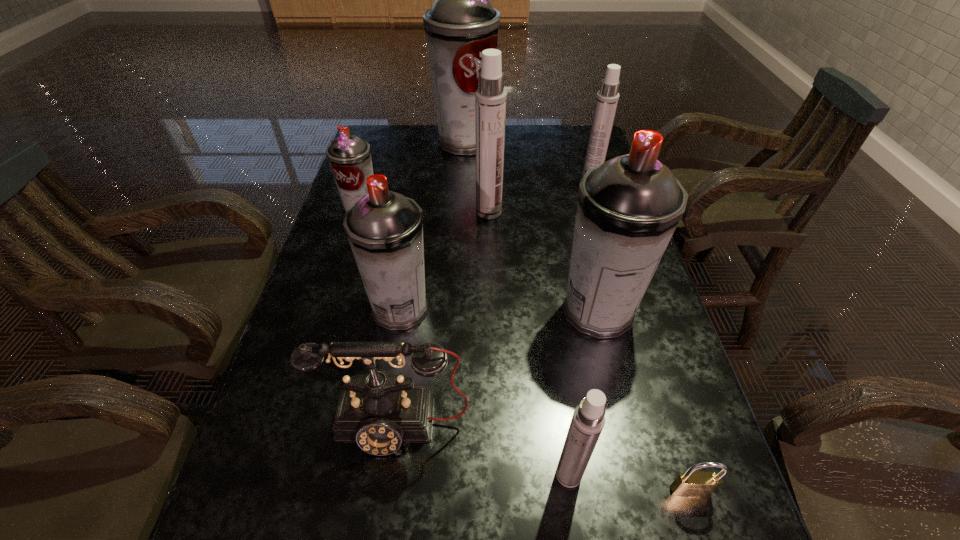
You are a GUI agent. You are given a task and a screenshot of the screen. Output one action in this format:
    pyautogui.click(x=<x>, y=<y>)
    Task: Click on the free space located on the left of the third biggest gray aerosol can
    The width and height of the screenshot is (960, 540).
    Given the screenshot: What is the action you would take?
    pyautogui.click(x=331, y=309)

Identify the location of vacant space positioned on the right of the third nearest gray aerosol can. click(503, 211).

At what (x,y) coordinates should I click in order to perform the action: click on vacant area situated on the back of the second white aerosol can from right to left. Please return your answer as a coordinate pair (x, y). The image size is (960, 540). Looking at the image, I should click on (546, 309).

The width and height of the screenshot is (960, 540). Find the location of `vacant area situated 0.070m on the dial of the black telephone`. vacant area situated 0.070m on the dial of the black telephone is located at coordinates (386, 498).

This screenshot has width=960, height=540. In order to click on object positioned at the far edge in this screenshot , I will do `click(462, 23)`.

This screenshot has width=960, height=540. Identify the location of telephone positioned at the left edge. (378, 410).

Locate an element on the screen. This screenshot has width=960, height=540. padlock positioned at the right edge is located at coordinates (687, 484).

This screenshot has height=540, width=960. I want to click on vacant region at the far edge, so click(516, 147).

Image resolution: width=960 pixels, height=540 pixels. Identify the location of vacant space at the left edge. (359, 311).

I want to click on vacant region at the right edge, so click(667, 345).